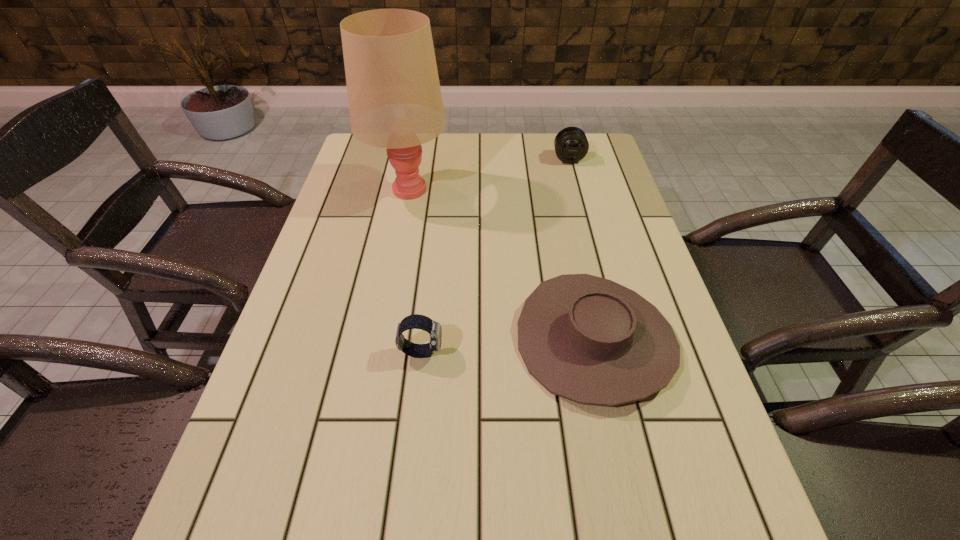
Locate an element on the screen. The width and height of the screenshot is (960, 540). the tallest object is located at coordinates (395, 102).

This screenshot has width=960, height=540. I want to click on the second farthest object, so click(x=395, y=102).

Find the location of a particular element. watch is located at coordinates (416, 321).

Where is `the farthest object`? The height and width of the screenshot is (540, 960). the farthest object is located at coordinates (571, 145).

At what (x,y) coordinates should I click in order to perform the action: click on cowboy hat. Please return your answer as a coordinate pair (x, y). Looking at the image, I should click on 588,339.

Where is `vacant space situated 0.230m on the front of the tallest object`? vacant space situated 0.230m on the front of the tallest object is located at coordinates (391, 275).

The image size is (960, 540). I want to click on vacant region located on the face of the watch, so click(521, 352).

At what (x,y) coordinates should I click in order to perform the action: click on blank space located 0.350m on the front-facing side of the telephoto lens. Please return your answer as a coordinate pair (x, y). The height and width of the screenshot is (540, 960). Looking at the image, I should click on (589, 239).

Find the location of a particular element. Image resolution: width=960 pixels, height=540 pixels. free spot located on the front of the cowboy hat is located at coordinates (638, 537).

This screenshot has width=960, height=540. What are the coordinates of `lampshade that is at the far edge` in the screenshot? It's located at (395, 102).